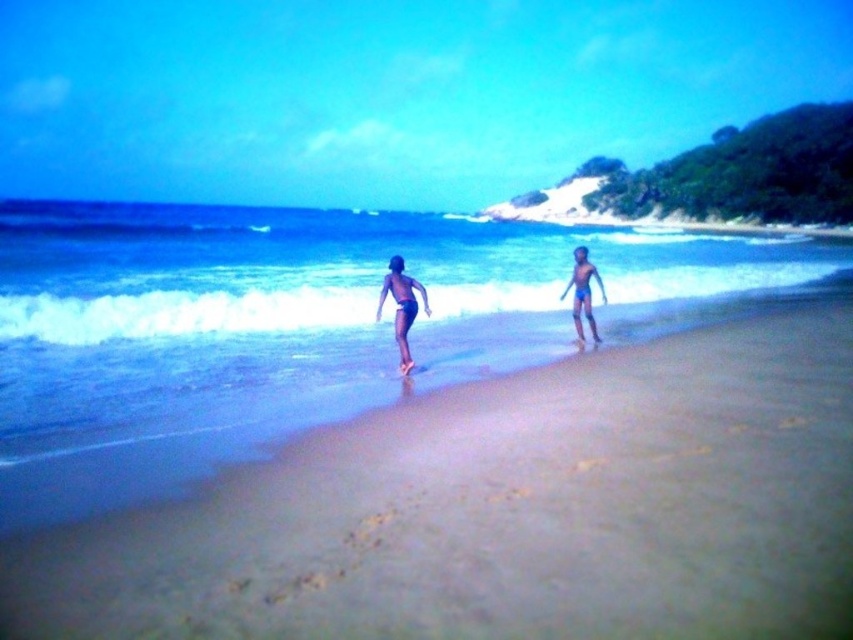
Question: Is sandy beach at center bigger than blue water at center?

Choices:
 (A) yes
 (B) no

Answer: (B)

Question: Is dark blue swim trunks at center to the left of blue matte swimsuit at center from the viewer's perspective?

Choices:
 (A) no
 (B) yes

Answer: (B)

Question: Is blue water at center closer to camera compared to blue matte swimsuit at center?

Choices:
 (A) yes
 (B) no

Answer: (A)

Question: Which point is farther from the camera taking this photo?

Choices:
 (A) (395, 280)
 (B) (589, 420)
 (C) (428, 260)
 (D) (405, 371)

Answer: (C)

Question: Among these points, which one is farthest from the camera?

Choices:
 (A) 410,292
 (B) 614,516
 (C) 134,288
 (D) 405,330

Answer: (C)

Question: Which object appears closest to the camera in this image?

Choices:
 (A) blue matte swimsuit at center
 (B) blue water at center
 (C) matte blue shorts at center

Answer: (B)